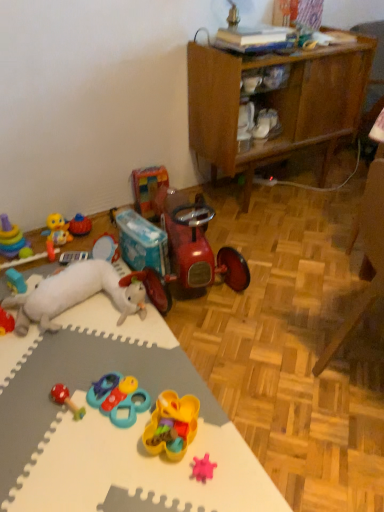
Locate an element on the screen. Image resolution: width=384 pixels, height=512 pixels. vacant space in front of teal plastic toy at center, the 5th toy viewed from the right is located at coordinates (107, 456).